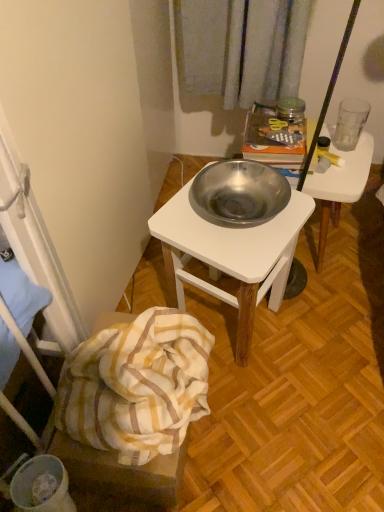
Where is `vacant point above polished stainless steel bowl at center, positioned as the 1th desk in left-to-right order (from a real-world perspective)`? This screenshot has height=512, width=384. vacant point above polished stainless steel bowl at center, positioned as the 1th desk in left-to-right order (from a real-world perspective) is located at coordinates (240, 214).